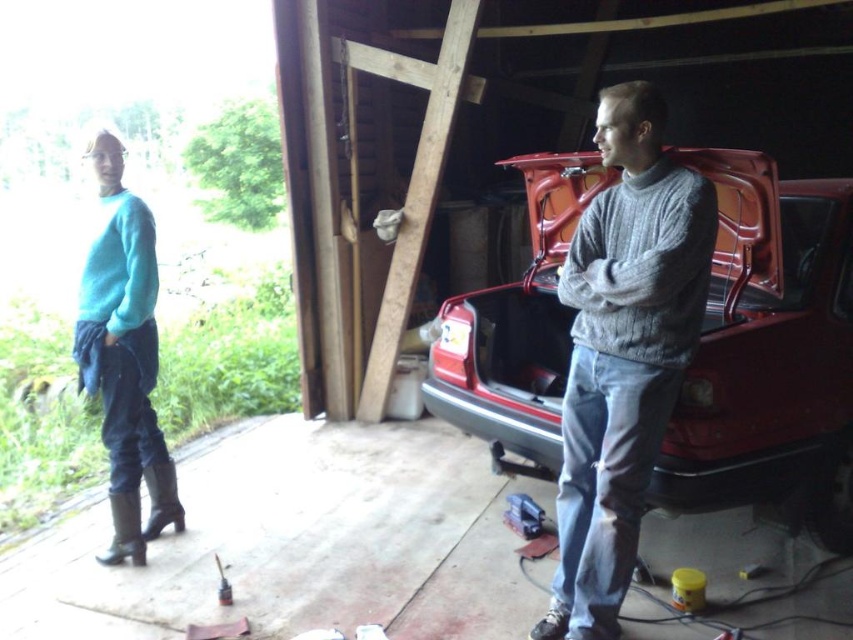
What do you see at coordinates (769, 353) in the screenshot?
I see `matte red car at center` at bounding box center [769, 353].

Image resolution: width=853 pixels, height=640 pixels. Identify the location of matte red car at center. [769, 353].

Is point (538, 456) positioned in front of point (103, 170)?

No, (538, 456) is behind (103, 170).

At what (x,y) coordinates should I click in order to perform the action: click on matte red car at center. Please return your answer as a coordinate pair (x, y). This screenshot has width=853, height=640. Looking at the image, I should click on (769, 353).

Measure the distance between matte red car at center and gray knitted sweater at center.

matte red car at center is 18.24 inches from gray knitted sweater at center.

In the scene shown: Who is shorter, matte red car at center or gray knitted sweater at center?

matte red car at center

This screenshot has width=853, height=640. Identify the location of matte red car at center. (769, 353).

Does gray knitted sweater at center appear on the left side of teal sweater at left?

No, gray knitted sweater at center is not to the left of teal sweater at left.

Does gray knitted sweater at center appear on the right side of teal sweater at left?

Yes, gray knitted sweater at center is to the right of teal sweater at left.

Which is in front, point (622, 428) or point (96, 285)?

Point (622, 428)

This screenshot has height=640, width=853. What are the coordinates of `gray knitted sweater at center` in the screenshot? It's located at (x=624, y=353).